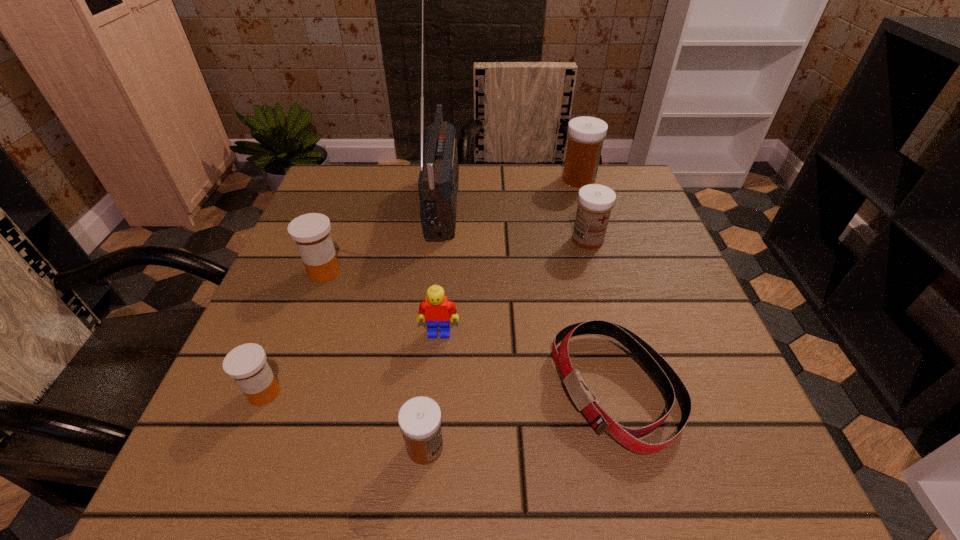
I want to click on radio receiver, so click(438, 180).

You are a GUI agent. You are given a task and a screenshot of the screen. Output one action in this format:
    pyautogui.click(x=<x>, y=<y>)
    Task: Click on the farthest white medicine
    
    Given the screenshot: What is the action you would take?
    pyautogui.click(x=586, y=134)

At what (x,y) coordinates should I click in order to perform the action: click on the tallest medicine. Please return your answer as a coordinate pair (x, y). Looking at the image, I should click on (586, 134).

You are a GUI agent. You are given a task and a screenshot of the screen. Output one action in this format:
    pyautogui.click(x=<x>, y=<y>)
    Task: Click on the fifth nearest object
    This screenshot has width=960, height=540.
    Given the screenshot: What is the action you would take?
    pyautogui.click(x=311, y=232)

I want to click on the farther orange medicine, so click(311, 232).

I want to click on the second farthest white medicine, so click(x=595, y=201).

Locate an element on the screen. the second biggest white medicine is located at coordinates (595, 201).

Where is `Lego`? Lego is located at coordinates (437, 309).

At what (x,y) coordinates should I click in order to perform the action: click on the nearer orange medicine. Please return your answer as a coordinate pair (x, y). Image resolution: width=960 pixels, height=540 pixels. Looking at the image, I should click on (247, 364).

Locate an element on the screen. This screenshot has height=540, width=960. the second nearest medicine is located at coordinates (247, 364).